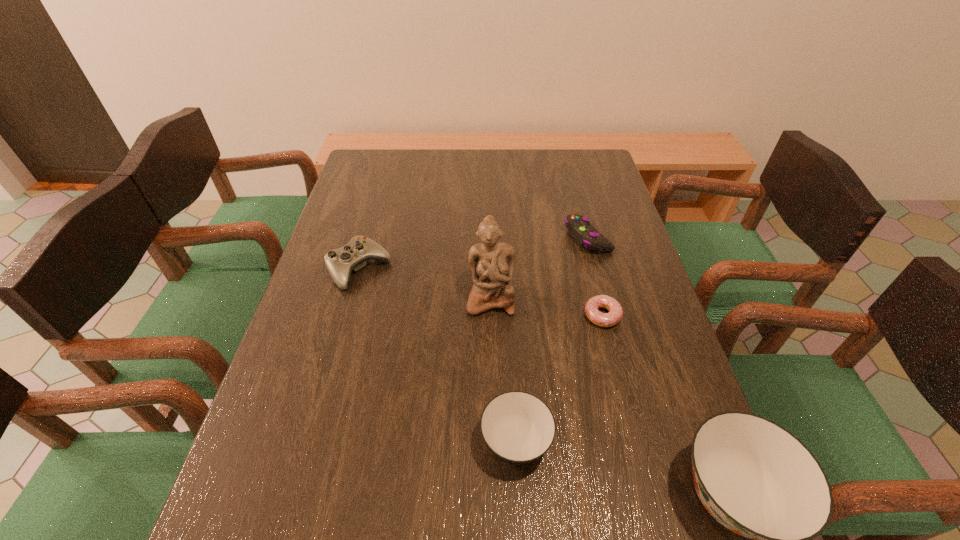
The soup bowls are evenly distributed in the image. To maintain this, where would you place another soup bowl on the left? Please point to a free space. Please provide its 2D coordinates. Your answer should be formatted as a tuple, i.e. [(x, y)], where the tuple contains the x and y coordinates of a point satisfying the conditions above.

[(331, 398)]